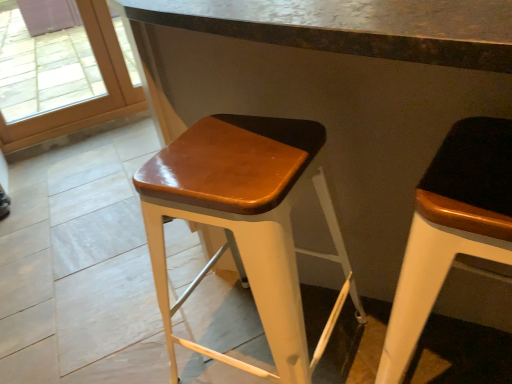
The image size is (512, 384). I want to click on vacant space situated above matte black stool at right, which is the second stool from left to right (from a real-world perspective), so click(x=473, y=166).